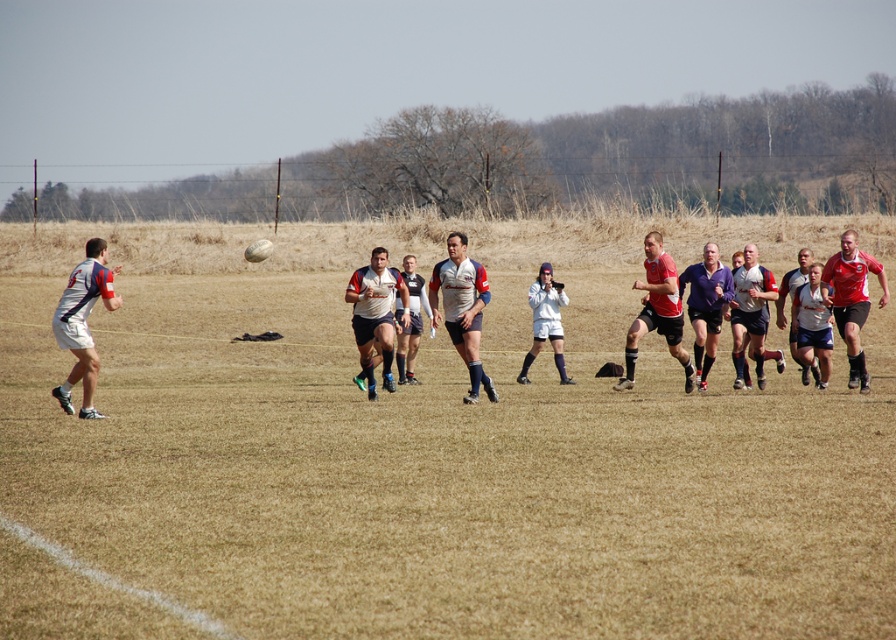
The height and width of the screenshot is (640, 896). Describe the element at coordinates (375, 314) in the screenshot. I see `matte white rugby ball at center` at that location.

Between matte white rugby ball at center and red jersey at right, which one is positioned higher?

red jersey at right

You are a GUI agent. You are given a task and a screenshot of the screen. Output one action in this format:
    pyautogui.click(x=<x>, y=<y>)
    Task: Click on the matte white rugby ball at center
    
    Given the screenshot: What is the action you would take?
    (x=375, y=314)

You are a GUI agent. You are given a task and a screenshot of the screen. Output one action in this format:
    pyautogui.click(x=<x>, y=<y>)
    Task: Click on the matte white rugby ball at center
    The image size is (896, 640).
    Given the screenshot: What is the action you would take?
    pyautogui.click(x=375, y=314)

Does red jersey at right appear over white matte jersey at center?

Indeed, red jersey at right is positioned over white matte jersey at center.

Is red jersey at right shorter than white matte jersey at center?

No.

Which is behind, point (860, 353) or point (811, 280)?

Point (811, 280)

Locate an element on the screen. The height and width of the screenshot is (640, 896). red jersey at right is located at coordinates (851, 300).

Looking at this image, can you confirm if matte white rugby ball at center is smaller than white matte jacket at center?

No.

Does matte white rugby ball at center have a greater height compared to white matte jacket at center?

Yes, matte white rugby ball at center is taller than white matte jacket at center.

Is point (383, 324) positioned after point (561, 355)?

No.

Identify the location of matte white rugby ball at center. This screenshot has width=896, height=640. (375, 314).